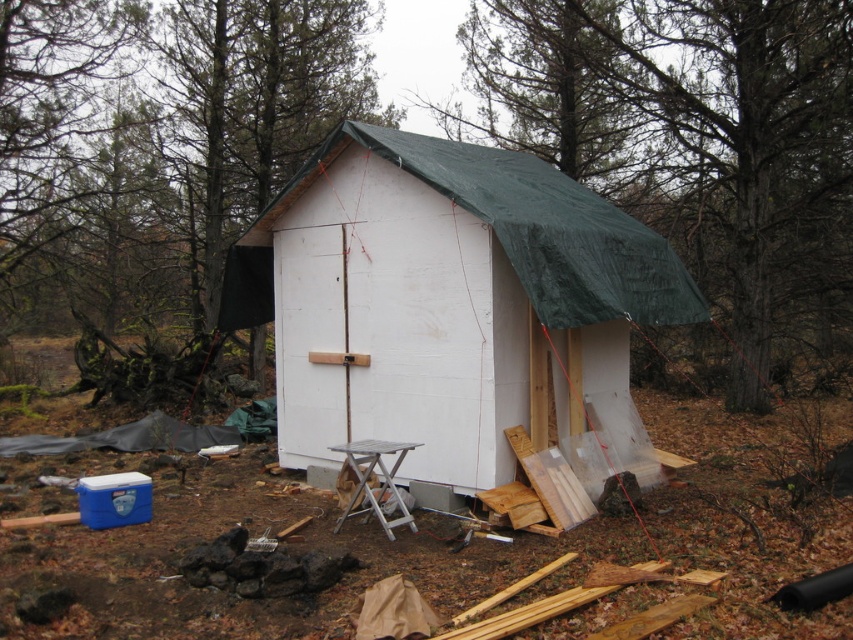
You are a contractor assessing the construction site. You need to determine if the silver metallic stool at lower center can be placed under the door of the white painted wood hut at center without any modifications. Based on their heights, what is your assessment?

The white painted wood hut at center is taller than the silver metallic stool at lower center, so placing the stool under the door should be possible as the height of the hut allows clearance.

You are standing in the wooded area and want to enter the white painted wood hut at center. There is a silver metallic stool at lower center blocking your path. Can you walk around the stool to reach the hut?

The white painted wood hut at center is closer to the viewer than the silver metallic stool at lower center, so the stool is further away from you. You can walk around the stool to reach the hut.